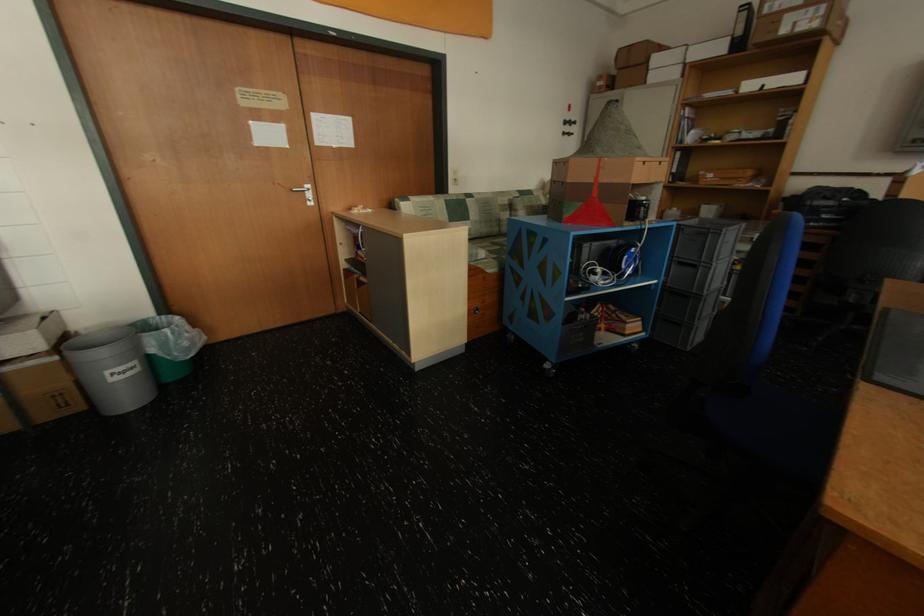
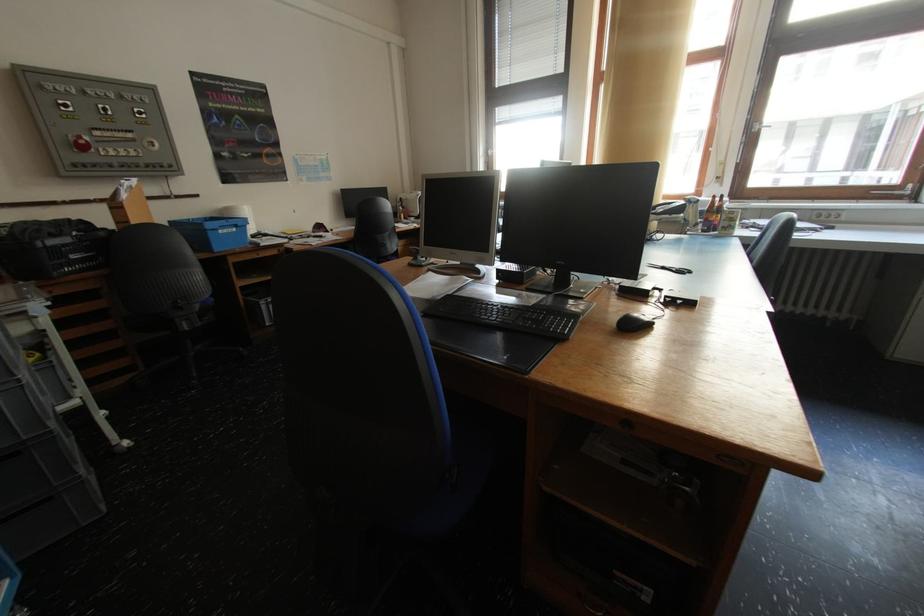
Find the pixel in the second image that matches (862,297) in the first image.

(192, 323)